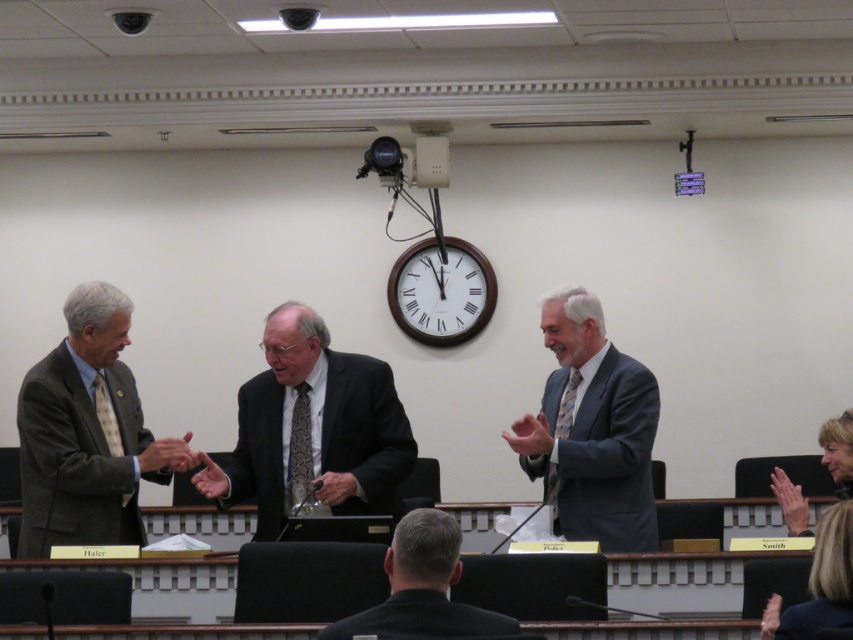
Question: Which is farther from the black suit at center?

Choices:
 (A) dark gray suit at center
 (B) matte brown suit at left
 (C) black matte suit at center

Answer: (B)

Question: Estimate the real-world distances between objects in this image. Which object is closer to the white wooden clock at upper center?

Choices:
 (A) black matte suit at center
 (B) black suit at center
 (C) dark gray suit at center
 (D) matte brown suit at left

Answer: (C)

Question: Is black suit at center positioned before black matte suit at center?

Choices:
 (A) yes
 (B) no

Answer: (A)

Question: Is dark gray suit at center wider than white wooden clock at upper center?

Choices:
 (A) no
 (B) yes

Answer: (B)

Question: Does matte gray suit at center have a lesser width compared to white wooden clock at upper center?

Choices:
 (A) no
 (B) yes

Answer: (B)

Question: Which point is closer to the camera?

Choices:
 (A) (405, 596)
 (B) (369, 465)
 (C) (393, 547)

Answer: (A)